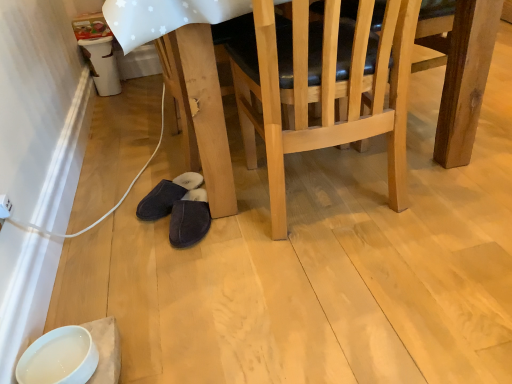
Question: Does dark suede slippers at lower center, marked as the second footwear in a right-to-left arrangement, appear on the right side of natural wood chair at center?

Choices:
 (A) yes
 (B) no

Answer: (B)

Question: From a real-world perspective, is dark suede slippers at lower center, the first footwear when ordered from left to right, over natural wood chair at center?

Choices:
 (A) no
 (B) yes

Answer: (A)

Question: Is dark suede slippers at lower center, the first footwear when ordered from left to right, positioned before natural wood chair at center?

Choices:
 (A) no
 (B) yes

Answer: (A)

Question: Is dark suede slippers at lower center, marked as the second footwear in a right-to-left arrangement, taller than natural wood chair at center?

Choices:
 (A) no
 (B) yes

Answer: (A)

Question: Is dark suede slippers at lower center, the first footwear when ordered from left to right, looking in the opposite direction of natural wood chair at center?

Choices:
 (A) yes
 (B) no

Answer: (B)

Question: Is dark suede slippers at lower center, marked as the second footwear in a right-to-left arrangement, far from natural wood chair at center?

Choices:
 (A) yes
 (B) no

Answer: (B)

Question: Is dark suede slippers at lower center, marked as the second footwear in a right-to-left arrangement, at the right side of white glossy bowl at lower left?

Choices:
 (A) yes
 (B) no

Answer: (A)

Question: Does dark suede slippers at lower center, the first footwear when ordered from left to right, have a greater width compared to white glossy bowl at lower left?

Choices:
 (A) yes
 (B) no

Answer: (A)

Question: Is the depth of dark suede slippers at lower center, marked as the second footwear in a right-to-left arrangement, greater than that of white glossy bowl at lower left?

Choices:
 (A) yes
 (B) no

Answer: (A)

Question: Is dark suede slippers at lower center, marked as the second footwear in a right-to-left arrangement, completely or partially outside of white glossy bowl at lower left?

Choices:
 (A) no
 (B) yes

Answer: (B)

Question: From a real-world perspective, is dark suede slippers at lower center, marked as the second footwear in a right-to-left arrangement, positioned under white glossy bowl at lower left based on gravity?

Choices:
 (A) no
 (B) yes

Answer: (B)

Question: From a real-world perspective, is dark suede slippers at lower center, marked as the second footwear in a right-to-left arrangement, over white glossy bowl at lower left?

Choices:
 (A) yes
 (B) no

Answer: (B)

Question: Is dark suede slippers at lower center, the first footwear when ordered from right to left, positioned behind natural wood chair at center?

Choices:
 (A) yes
 (B) no

Answer: (A)